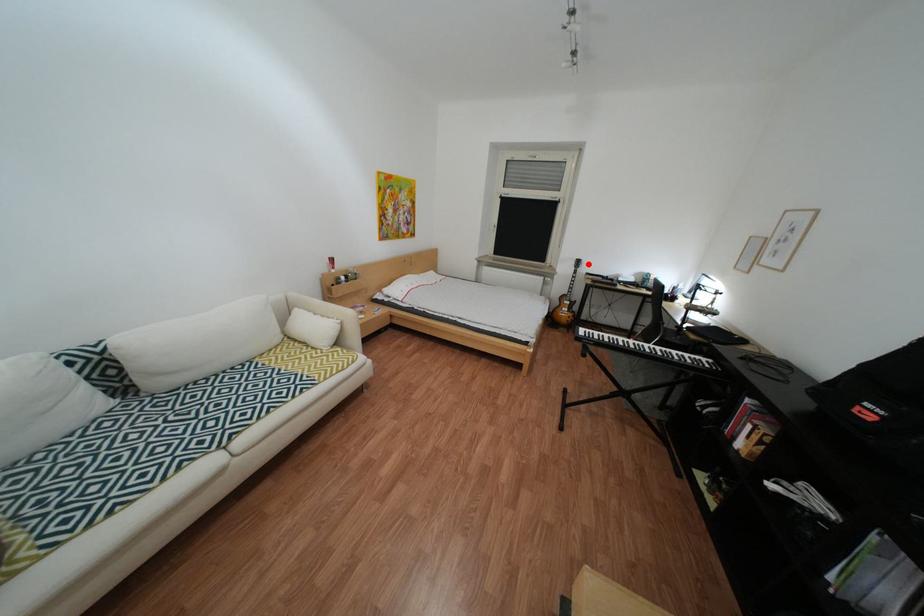
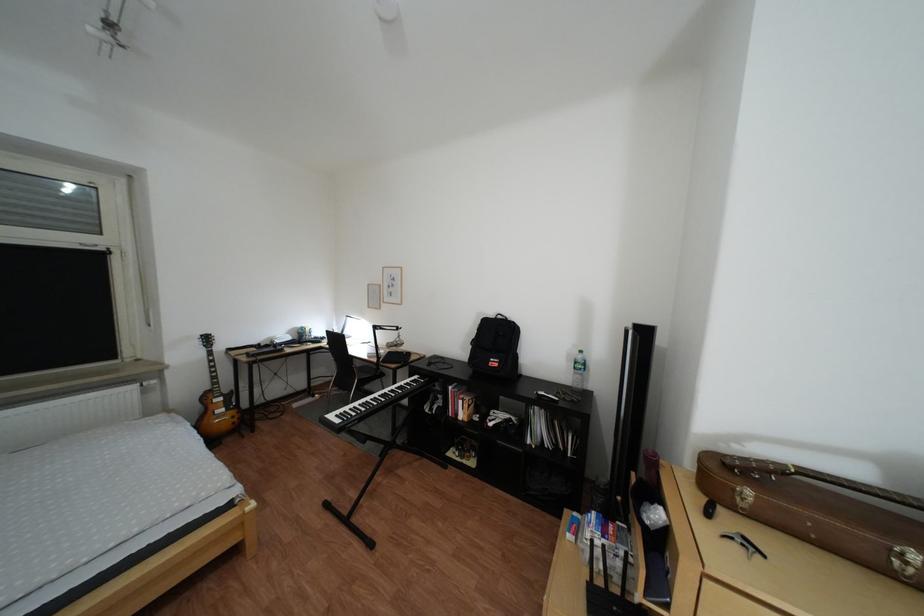
Locate, in the second image, the point that corresponds to the highlighted location in the first image.

(213, 344)